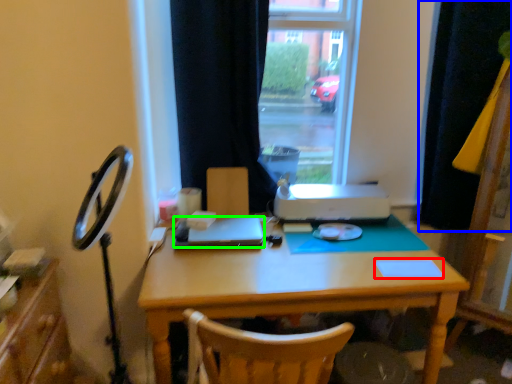
Question: Based on their relative distances, which object is nearer to notepad (highlighted by a red box)? Choose from curtain (highlighted by a blue box) and laptop (highlighted by a green box).

Choices:
 (A) curtain
 (B) laptop

Answer: (B)